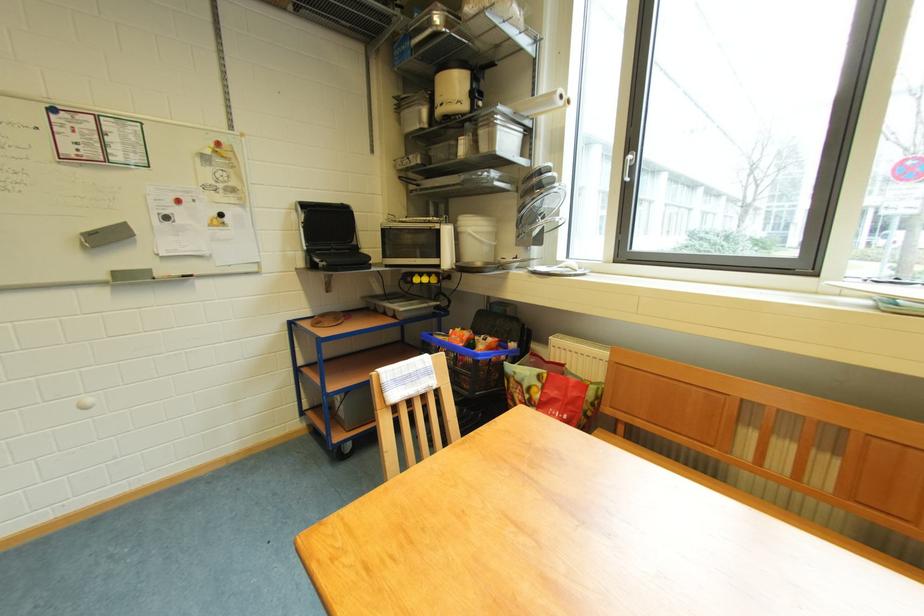
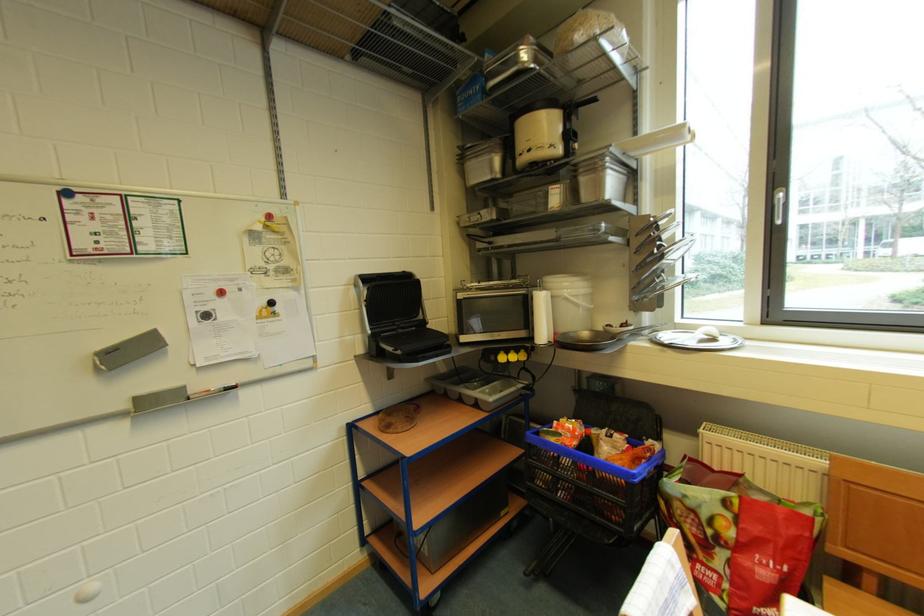
The point at (455, 235) is marked in the first image. Where is the corresponding point in the second image?

(548, 302)